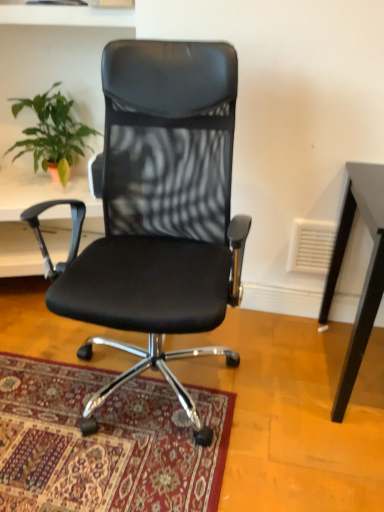
Question: Considering the relative positions of carpeted rug at center and green leafy plant at upper left in the image provided, is carpeted rug at center in front of green leafy plant at upper left?

Choices:
 (A) yes
 (B) no

Answer: (A)

Question: From the image's perspective, is carpeted rug at center located beneath green leafy plant at upper left?

Choices:
 (A) yes
 (B) no

Answer: (A)

Question: Does carpeted rug at center touch green leafy plant at upper left?

Choices:
 (A) no
 (B) yes

Answer: (A)

Question: Does carpeted rug at center appear on the right side of green leafy plant at upper left?

Choices:
 (A) no
 (B) yes

Answer: (B)

Question: Does carpeted rug at center turn towards green leafy plant at upper left?

Choices:
 (A) yes
 (B) no

Answer: (B)

Question: From their relative heights in the image, would you say green leafy plant at upper left is taller or shorter than carpeted rug at center?

Choices:
 (A) short
 (B) tall

Answer: (B)

Question: From a real-world perspective, relative to carpeted rug at center, is green leafy plant at upper left vertically above or below?

Choices:
 (A) below
 (B) above

Answer: (B)

Question: Is point (61, 164) closer or farther from the camera than point (18, 404)?

Choices:
 (A) closer
 (B) farther

Answer: (B)

Question: Considering the positions of green leafy plant at upper left and carpeted rug at center in the image, is green leafy plant at upper left wider or thinner than carpeted rug at center?

Choices:
 (A) wide
 (B) thin

Answer: (B)

Question: Is point (56, 138) positioned closer to the camera than point (218, 180)?

Choices:
 (A) closer
 (B) farther

Answer: (B)

Question: From their relative heights in the image, would you say green leafy plant at upper left is taller or shorter than black leather office chair at center?

Choices:
 (A) short
 (B) tall

Answer: (A)

Question: Is green leafy plant at upper left to the left or to the right of black leather office chair at center in the image?

Choices:
 (A) left
 (B) right

Answer: (A)

Question: Looking at the image, does green leafy plant at upper left seem bigger or smaller compared to black leather office chair at center?

Choices:
 (A) big
 (B) small

Answer: (B)

Question: Relative to green leafy plant at upper left, is black leather office chair at center in front or behind?

Choices:
 (A) front
 (B) behind

Answer: (A)

Question: Is black leather office chair at center wider or thinner than green leafy plant at upper left?

Choices:
 (A) wide
 (B) thin

Answer: (A)